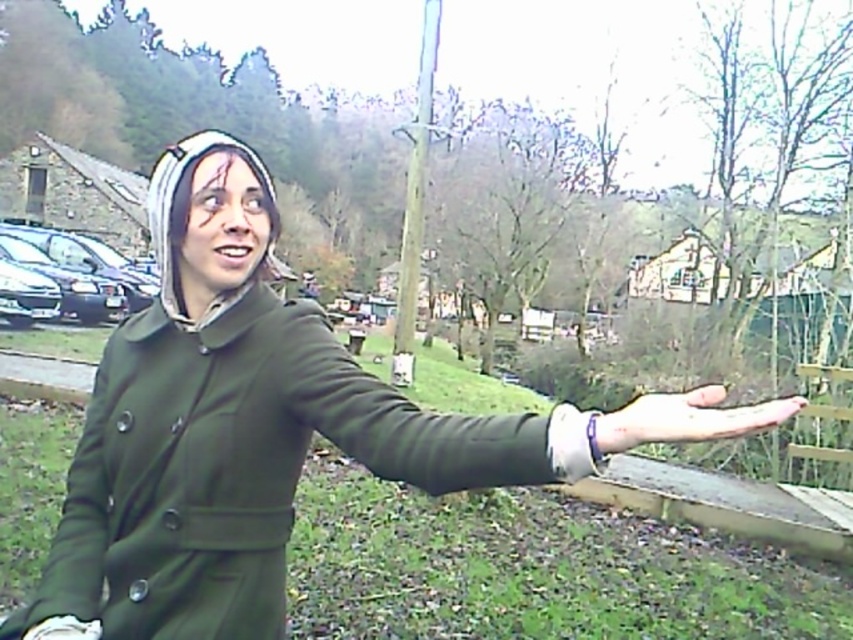
Question: Does green matte jacket at center come in front of green fabric arm at center?

Choices:
 (A) yes
 (B) no

Answer: (B)

Question: Can you confirm if green fabric arm at center is bigger than smooth skin hand at center?

Choices:
 (A) no
 (B) yes

Answer: (A)

Question: Which object is positioned closest to the green fabric arm at center?

Choices:
 (A) smooth skin hand at center
 (B) green matte jacket at center

Answer: (B)

Question: Considering the relative positions of green matte jacket at center and green fabric arm at center in the image provided, where is green matte jacket at center located with respect to green fabric arm at center?

Choices:
 (A) right
 (B) left

Answer: (B)

Question: Among these points, which one is nearest to the camera?

Choices:
 (A) (258, 451)
 (B) (347, 387)
 (C) (788, 404)

Answer: (C)

Question: Which is farther from the green fabric arm at center?

Choices:
 (A) green matte jacket at center
 (B) smooth skin hand at center

Answer: (B)